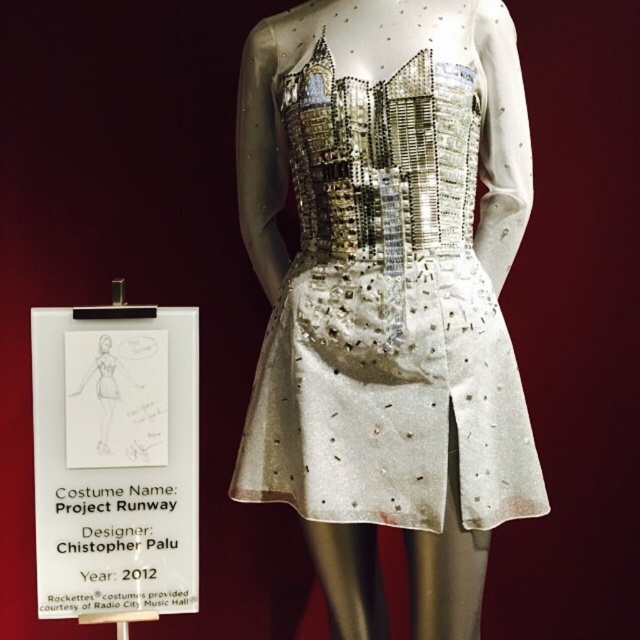
You are standing in front of the mannequin and want to touch the point at coordinates point [524,483]. Can you reach it without moving your position?

The point [524,483] is 1.32 meters away from you, so you cannot reach it without moving since the average human arm length is about 0.7 meters.